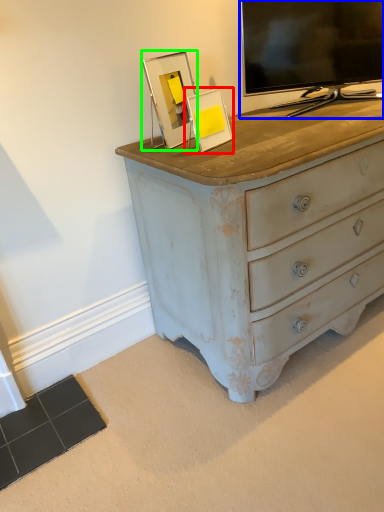
Question: Considering the real-world distances, which object is closest to picture frame (highlighted by a red box)? television (highlighted by a blue box) or picture frame (highlighted by a green box).

Choices:
 (A) television
 (B) picture frame

Answer: (B)